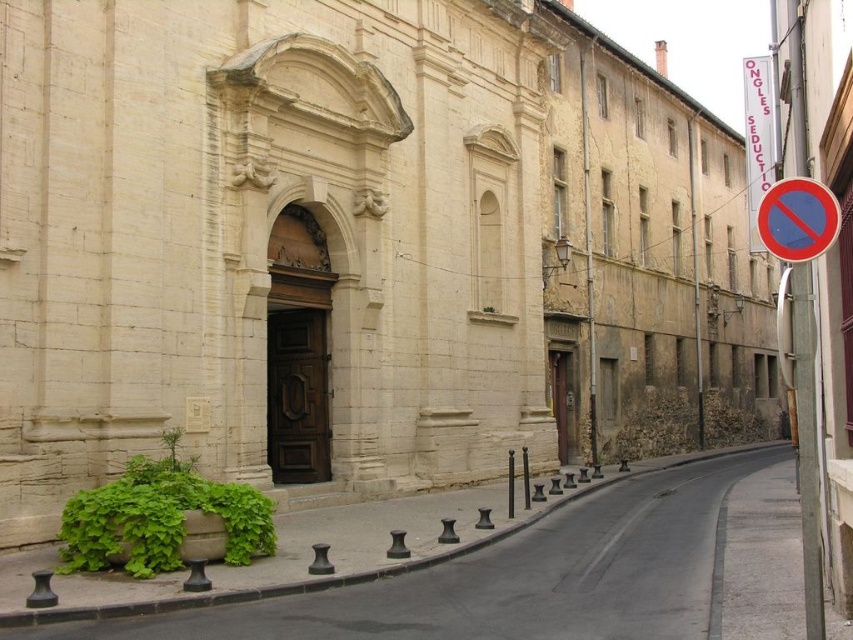
You are a delivery person trying to navigate a narrow street in a historic town. You see a green leafy plant at lower left and a red plastic sign at right. Which object takes up more space in the scene?

The green leafy plant at lower left is larger in size than the red plastic sign at right, so it takes up more space in the scene.

You are standing at the entrance of the beige stone building and want to walk to a point that is behind another point. Which of the two points, point (532, 554) or point (819, 234), should you head towards?

You should head towards point (532, 554) because it is behind point (819, 234) relative to your position at the entrance.